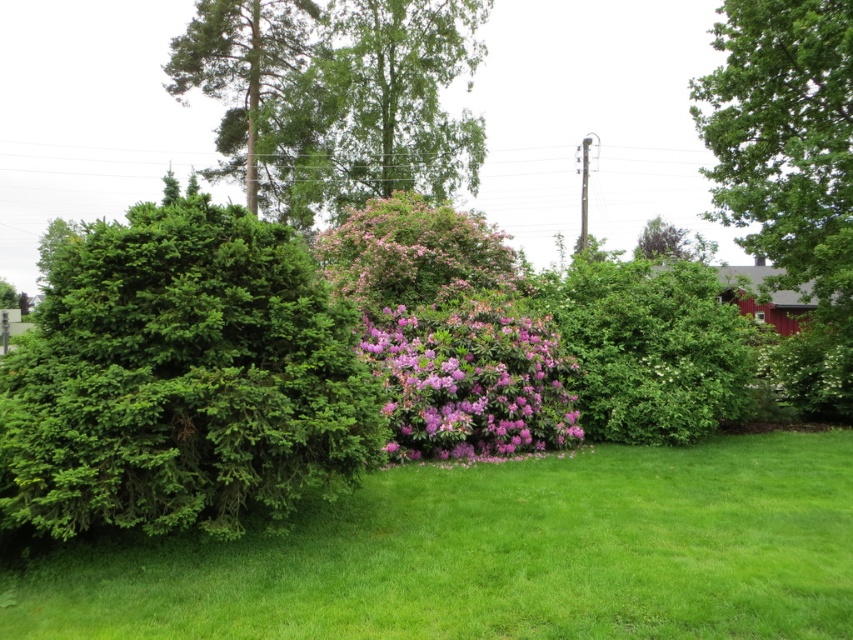
Is point (730, 52) positioned before point (465, 346)?

No, (730, 52) is behind (465, 346).

From the picture: Does green leafy tree at upper right have a smaller size compared to purple matte bush at center?

Incorrect, green leafy tree at upper right is not smaller in size than purple matte bush at center.

Between point (824, 8) and point (422, 364), which one is positioned behind?

Point (824, 8)

This screenshot has width=853, height=640. In order to click on green leafy tree at upper right in this screenshot , I will do `click(784, 138)`.

Does green leafy hedge at center appear on the left side of purple matte bush at center?

No, green leafy hedge at center is not to the left of purple matte bush at center.

Between green leafy hedge at center and purple matte bush at center, which one appears on the right side from the viewer's perspective?

green leafy hedge at center

The width and height of the screenshot is (853, 640). Identify the location of green leafy hedge at center. (651, 348).

This screenshot has width=853, height=640. Find the location of `green leafy hedge at center`. green leafy hedge at center is located at coordinates (651, 348).

Between green leafy hedge at center and pink matte bush at center, which one has less height?

Standing shorter between the two is green leafy hedge at center.

From the picture: Which is above, green leafy hedge at center or pink matte bush at center?

pink matte bush at center

Describe the element at coordinates (651, 348) in the screenshot. The width and height of the screenshot is (853, 640). I see `green leafy hedge at center` at that location.

Identify the location of green leafy hedge at center. Image resolution: width=853 pixels, height=640 pixels. (651, 348).